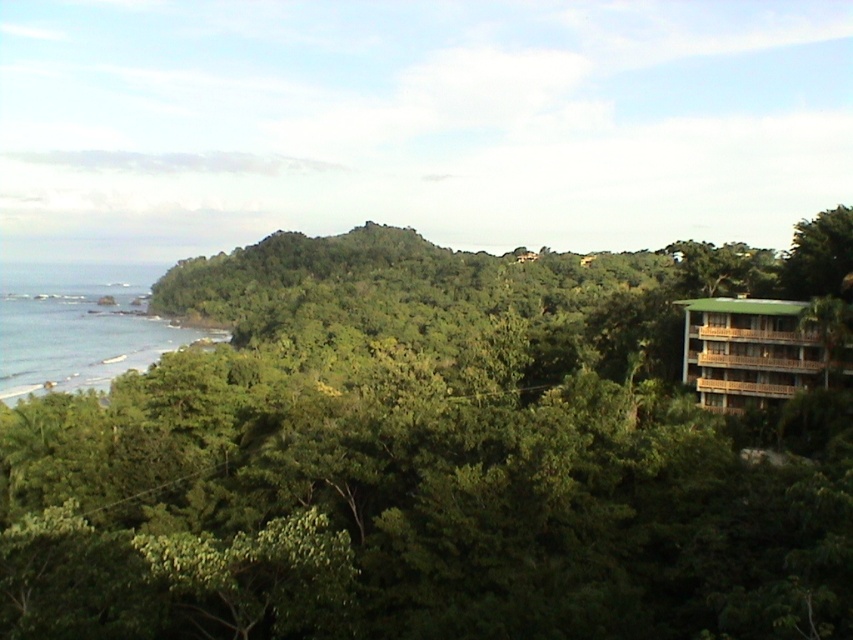
You are standing at the point labeled as point (x=447, y=452) in the image. What is the nearest object to you?

The nearest object to you is the green leafy tree at center because the point (x=447, y=452) is located on it.

You are a hiker trying to locate the green wooden hotel at right in the dense forest. From your current position at the green leafy tree at center, which direction should you head to reach the hotel?

The green leafy tree at center is positioned on the left side of green wooden hotel at right, so you should head to the right to reach the green wooden hotel at right.